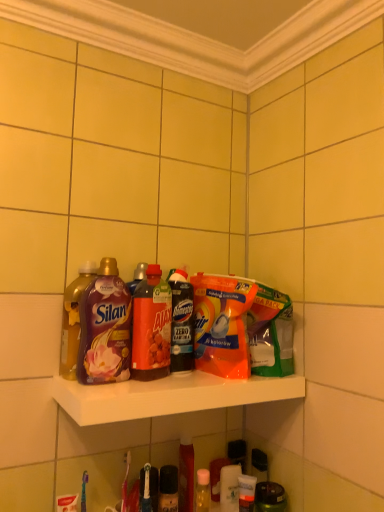
This screenshot has height=512, width=384. What are the coordinates of `empty space that is to the right of matte plastic bottle at left, arranged as the 2th bottle when viewed from the left` in the screenshot? It's located at pos(162,383).